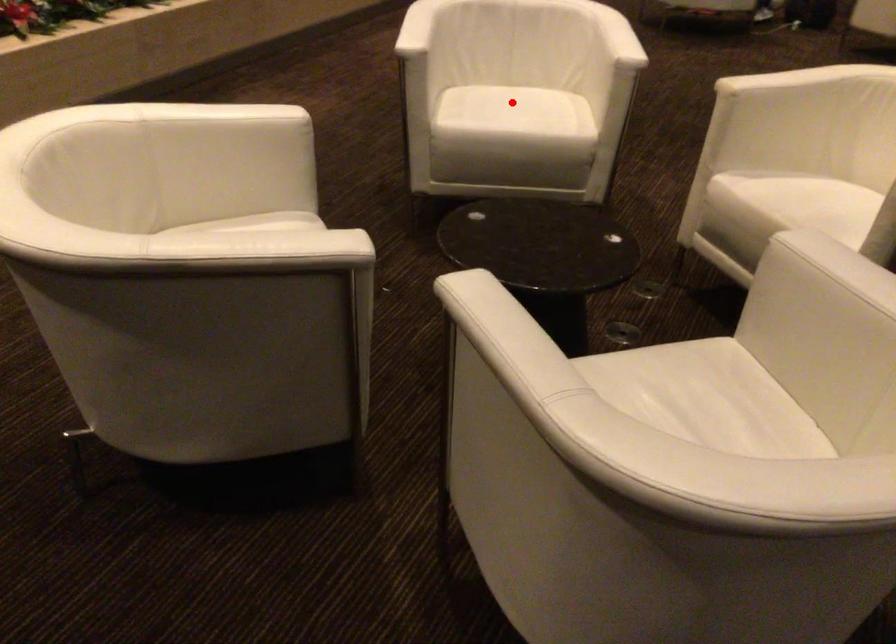
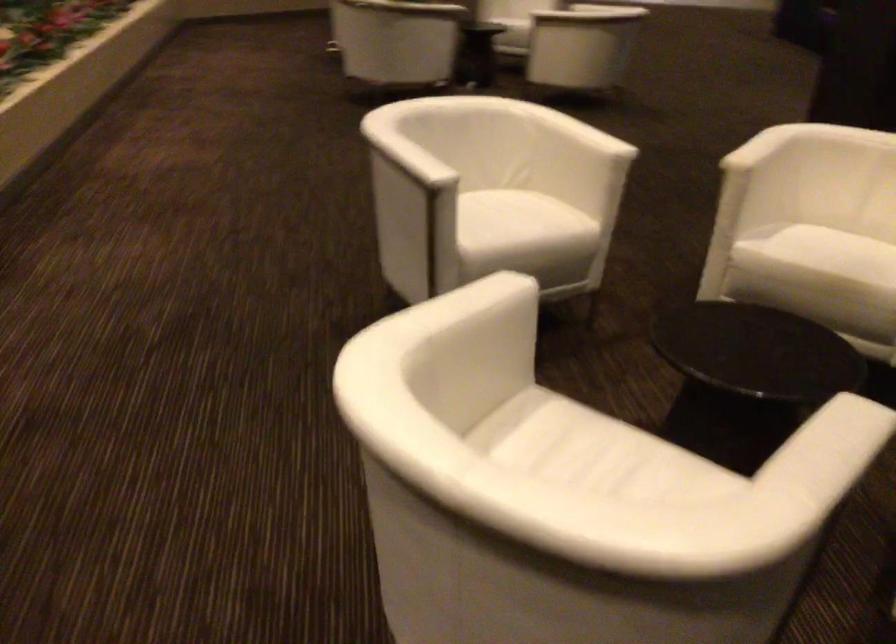
Where in the second image is the point corresponding to the highlighted location from the first image?

(502, 214)